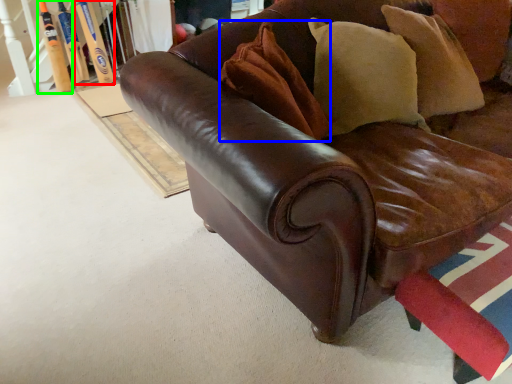
Question: Which object is the closest to the baseball bat (highlighted by a red box)? Choose among these: pillow (highlighted by a blue box) or baseball bat (highlighted by a green box).

Choices:
 (A) pillow
 (B) baseball bat

Answer: (B)